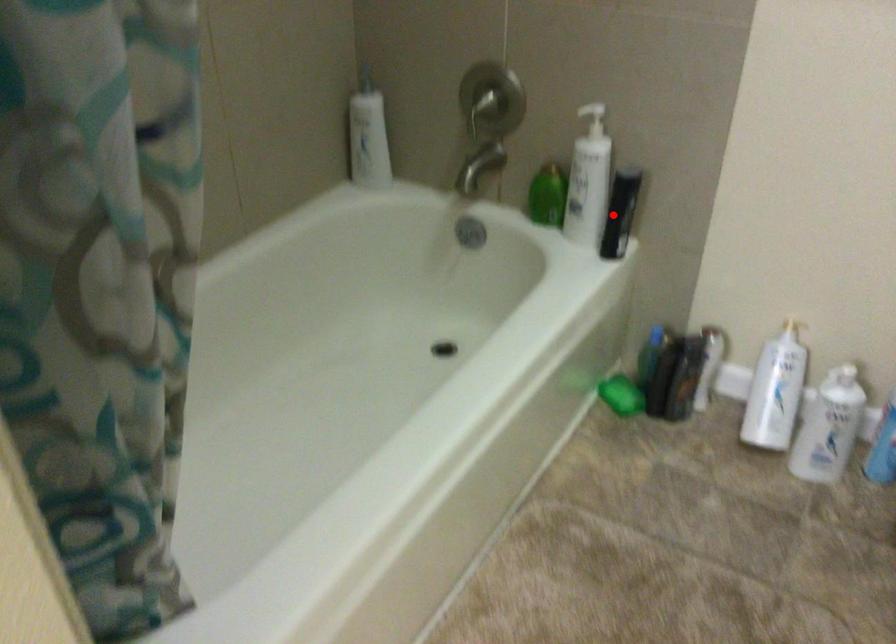
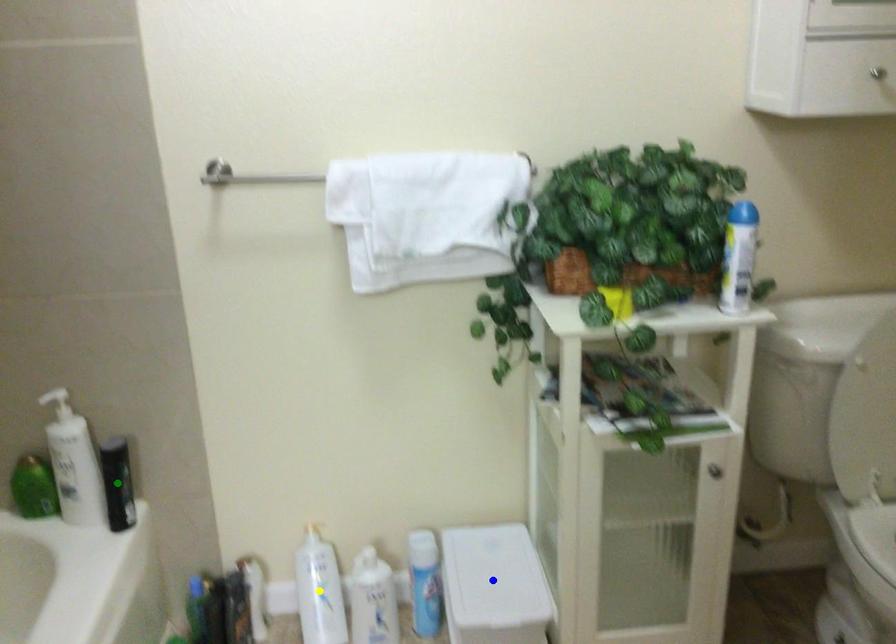
Question: I am providing you with two images of the same scene from different viewpoints. A red point is marked on the first image. You are given multiple points on the second image. In image 2, which mark is for the same physical point as the one in image 1?

Choices:
 (A) green point
 (B) blue point
 (C) yellow point

Answer: (A)